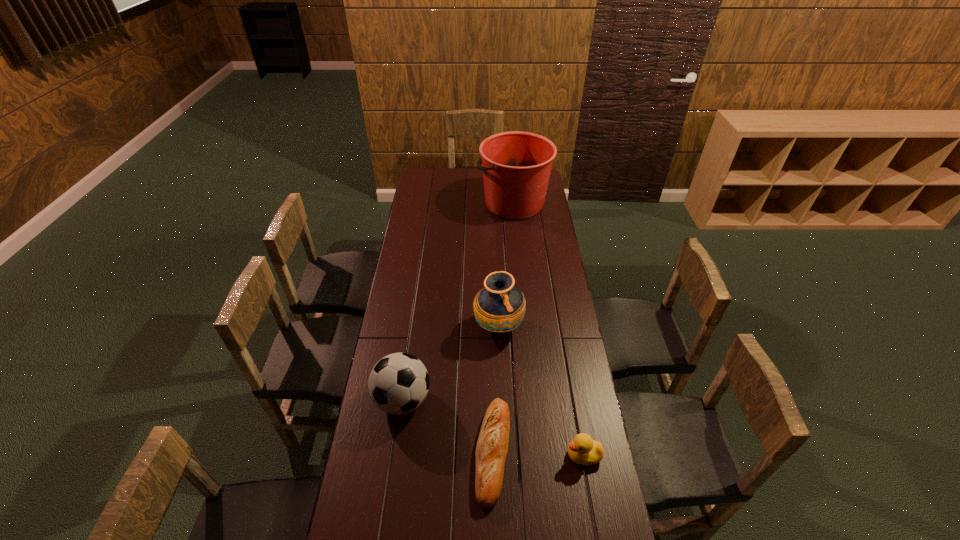
At what (x,y) coordinates should I click in order to perform the action: click on the tallest object. Please return your answer as a coordinate pair (x, y). The width and height of the screenshot is (960, 540). Looking at the image, I should click on (516, 165).

I want to click on the farthest object, so click(516, 165).

The height and width of the screenshot is (540, 960). Find the location of `the fourth nearest object`. the fourth nearest object is located at coordinates (500, 307).

This screenshot has height=540, width=960. I want to click on pottery, so click(500, 307).

Find the location of a particular element. The image size is (960, 540). the leftmost object is located at coordinates (398, 383).

Where is `soccer ball`? This screenshot has width=960, height=540. soccer ball is located at coordinates (398, 383).

Locate an element on the screen. The width and height of the screenshot is (960, 540). duck is located at coordinates (583, 450).

Identify the location of baguet. This screenshot has width=960, height=540. (492, 446).

In order to click on vacant space positioned 0.190m on the back of the bucket in this screenshot , I will do `click(510, 168)`.

You are a GUI agent. You are given a task and a screenshot of the screen. Output one action in this format:
    pyautogui.click(x=<x>, y=<y>)
    Task: Click on the blank space located on the left of the second tallest object
    
    Given the screenshot: What is the action you would take?
    pyautogui.click(x=391, y=327)